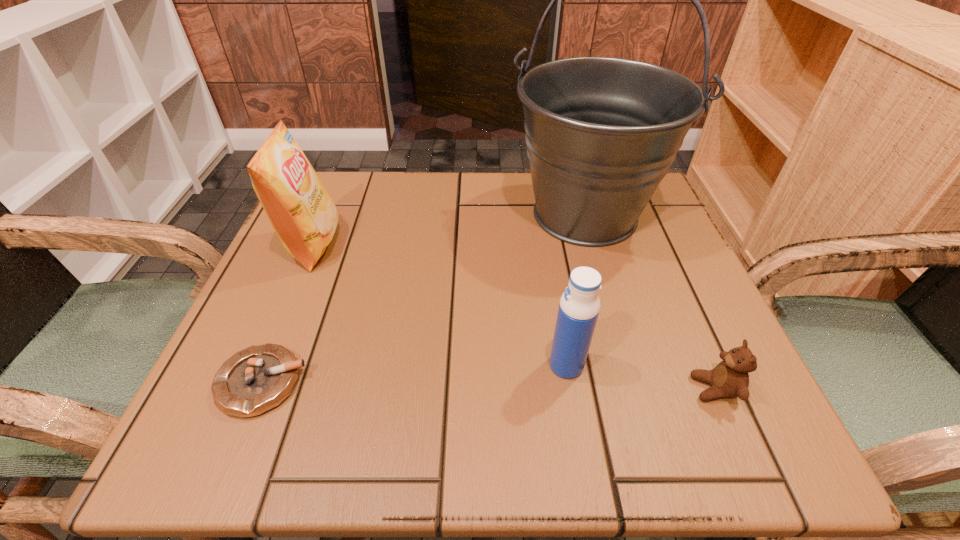
Where is `vacant area located 0.120m at the face of the teddy bear`? Image resolution: width=960 pixels, height=540 pixels. vacant area located 0.120m at the face of the teddy bear is located at coordinates (610, 388).

This screenshot has height=540, width=960. I want to click on vacant region located 0.340m on the back of the shortest object, so click(x=329, y=218).

At what (x,y) coordinates should I click in order to perform the action: click on bucket situated at the far edge. Please return your answer as a coordinate pair (x, y). The height and width of the screenshot is (540, 960). Looking at the image, I should click on (601, 133).

Identify the location of crisp (potato chip) at the far edge. (299, 208).

Locate an element on the screen. teddy bear situated at the near edge is located at coordinates (729, 379).

Identify the location of ashtray positioned at the near edge. (257, 379).

The width and height of the screenshot is (960, 540). In order to click on crisp (potato chip) present at the left edge in this screenshot , I will do `click(299, 208)`.

Image resolution: width=960 pixels, height=540 pixels. I want to click on ashtray that is at the left edge, so click(257, 379).

This screenshot has height=540, width=960. Find the location of `bucket that is at the right edge`. bucket that is at the right edge is located at coordinates tap(601, 133).

This screenshot has height=540, width=960. In order to click on teddy bear present at the right edge in this screenshot , I will do `click(729, 379)`.